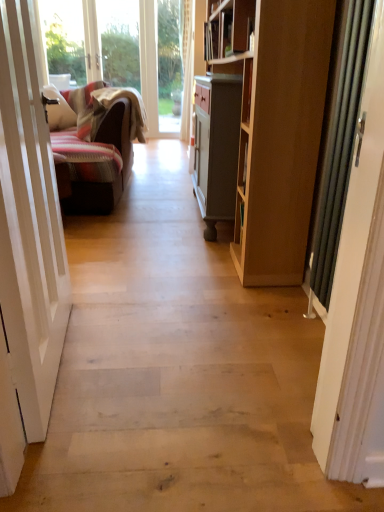
Question: Does white glossy door at left, which ranks as the 1th door in left-to-right order, appear on the left side of natural wood floor at center?

Choices:
 (A) yes
 (B) no

Answer: (A)

Question: Does white glossy door at left, which ranks as the 1th door in left-to-right order, lie behind natural wood floor at center?

Choices:
 (A) no
 (B) yes

Answer: (B)

Question: From a real-world perspective, does white glossy door at left, which appears as the second door when viewed from the right, sit lower than natural wood floor at center?

Choices:
 (A) no
 (B) yes

Answer: (A)

Question: Does white glossy door at left, which ranks as the 1th door in left-to-right order, have a lesser height compared to natural wood floor at center?

Choices:
 (A) no
 (B) yes

Answer: (A)

Question: Does white glossy door at left, which ranks as the 1th door in left-to-right order, have a larger size compared to natural wood floor at center?

Choices:
 (A) no
 (B) yes

Answer: (A)

Question: Do you think natural wood floor at center is within white glossy door at left, which ranks as the 1th door in left-to-right order, or outside of it?

Choices:
 (A) outside
 (B) inside

Answer: (A)

Question: From a real-world perspective, is natural wood floor at center positioned above or below white glossy door at left, which ranks as the 1th door in left-to-right order?

Choices:
 (A) above
 (B) below

Answer: (B)

Question: Based on their positions, is natural wood floor at center located to the left or right of white glossy door at left, which ranks as the 1th door in left-to-right order?

Choices:
 (A) right
 (B) left

Answer: (A)

Question: Considering the positions of natural wood floor at center and white glossy door at left, which appears as the second door when viewed from the right, in the image, is natural wood floor at center bigger or smaller than white glossy door at left, which appears as the second door when viewed from the right,?

Choices:
 (A) big
 (B) small

Answer: (A)

Question: Based on their sizes in the image, would you say white glossy door at left, which ranks as the 1th door in left-to-right order, is bigger or smaller than metallic silver door at right, which appears as the first door when viewed from the right?

Choices:
 (A) big
 (B) small

Answer: (A)

Question: Does point (39, 369) appear closer or farther from the camera than point (382, 168)?

Choices:
 (A) farther
 (B) closer

Answer: (A)

Question: Visually, is white glossy door at left, which appears as the second door when viewed from the right, positioned to the left or to the right of metallic silver door at right, which appears as the first door when viewed from the right?

Choices:
 (A) right
 (B) left

Answer: (B)

Question: Is white glossy door at left, which ranks as the 1th door in left-to-right order, inside or outside of metallic silver door at right, placed as the second door when sorted from left to right?

Choices:
 (A) outside
 (B) inside

Answer: (A)

Question: In the image, is white glossy door at left, which appears as the second door when viewed from the right, positioned in front of or behind natural wood floor at center?

Choices:
 (A) behind
 (B) front

Answer: (A)

Question: Is white glossy door at left, which appears as the second door when viewed from the right, wider or thinner than natural wood floor at center?

Choices:
 (A) wide
 (B) thin

Answer: (B)